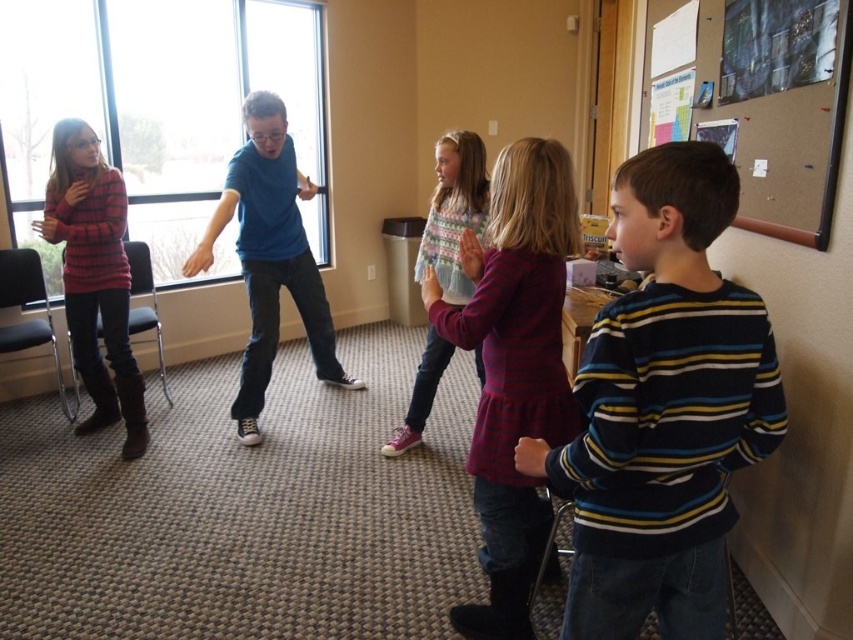
You are standing in the room and want to reach both the point at coordinates (x=485, y=460) and the point at coordinates (x=421, y=285). Which point will you reach first if you move straight towards them?

You will reach the point at coordinates (x=485, y=460) first because it is closer to you than the point at coordinates (x=421, y=285).

You are a photographer trying to capture the striped cotton dress at center and the pastel knitted sweater at center in a single shot. Which object should you focus on first to ensure both are in frame?

The striped cotton dress at center is positioned under the pastel knitted sweater at center, so you should focus on the pastel knitted sweater at center first to ensure both are in frame.